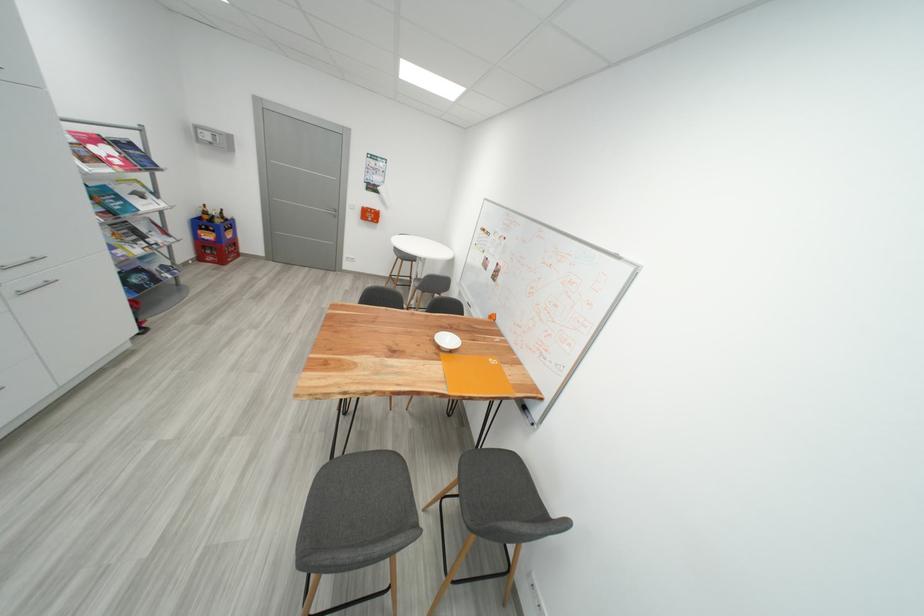
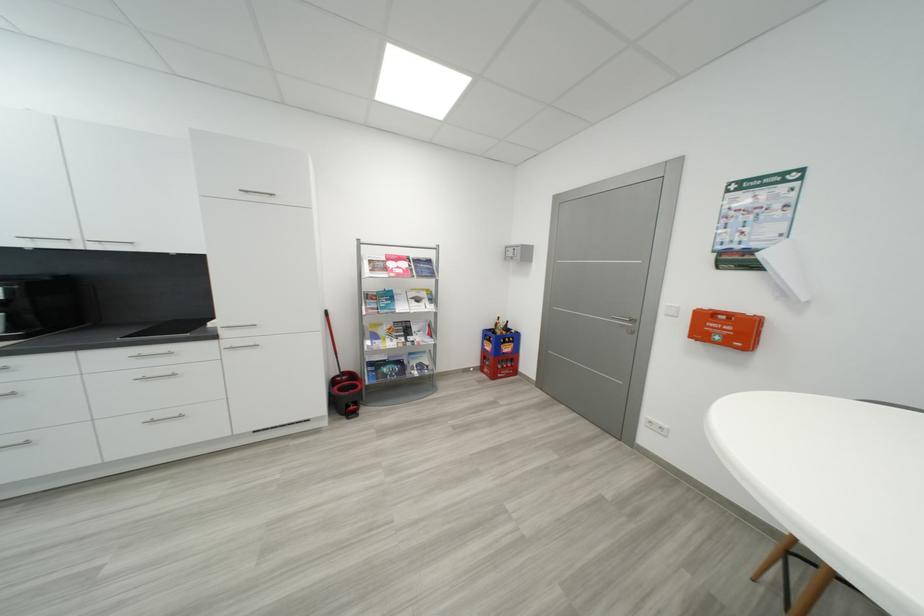
Locate, in the second image, the point that corresponds to pixel 104 161 in the first image.

(393, 270)